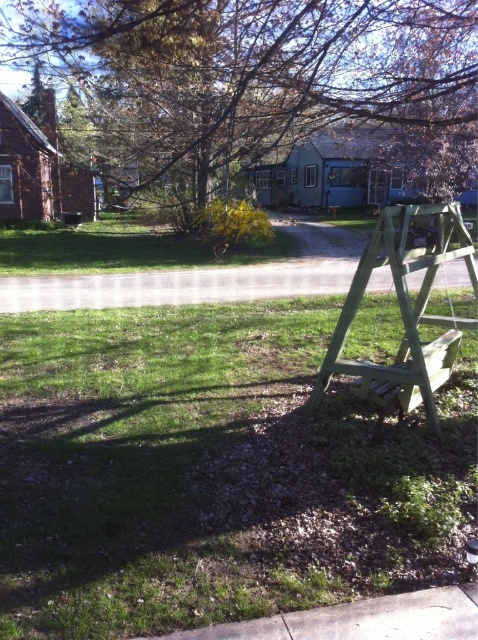
Who is more forward, [329,52] or [435,340]?

Positioned in front is point [435,340].

Is point (99, 99) farther from viewer compared to point (451, 356)?

That is True.

Is point (401, 48) positioned before point (397, 356)?

No, it is not.

The image size is (478, 640). I want to click on brown wood tree at upper center, so click(249, 68).

Does green grass at lower center appear under brown wood tree at upper center?

Yes.

Who is more forward, [186,388] or [459,35]?

Point [186,388]

Between point (22, 346) and point (54, 20), which one is positioned behind?

The point (54, 20) is behind.

The width and height of the screenshot is (478, 640). What are the coordinates of `green grass at lower center` in the screenshot? It's located at (210, 472).

Between point (454, 97) and point (477, 320), which one is positioned behind?

The point (454, 97) is behind.

At what (x,y) coordinates should I click in order to perform the action: click on brown wood tree at upper center. Please return your answer as a coordinate pair (x, y). Looking at the image, I should click on (249, 68).

At what (x,y) coordinates should I click in order to perform the action: click on brown wood tree at upper center. Please return your answer as a coordinate pair (x, y). Image resolution: width=478 pixels, height=640 pixels. Looking at the image, I should click on (249, 68).